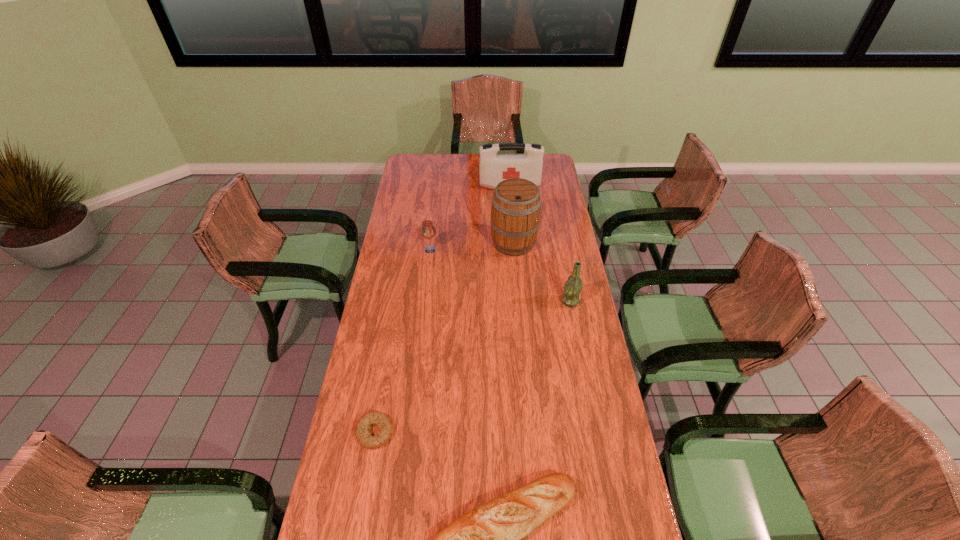
Where is `vacant space located on the surface of the rightmost object`? This screenshot has height=540, width=960. vacant space located on the surface of the rightmost object is located at coordinates (519, 301).

At what (x,y) coordinates should I click in order to perform the action: click on free space located on the surface of the rightmost object. Please return your answer as a coordinate pair (x, y). The width and height of the screenshot is (960, 540). Looking at the image, I should click on (482, 301).

You are a GUI agent. You are given a task and a screenshot of the screen. Output one action in this format:
    pyautogui.click(x=<x>, y=<y>)
    Task: Click on the free spot located 0.200m on the surface of the rightmost object
    
    Given the screenshot: What is the action you would take?
    pyautogui.click(x=512, y=301)

The height and width of the screenshot is (540, 960). In order to click on vacant area situated 0.120m on the right of the fifth object from right to left in this screenshot , I will do `click(464, 249)`.

Where is `free space located on the back of the second nearest object`? The height and width of the screenshot is (540, 960). free space located on the back of the second nearest object is located at coordinates (388, 355).

Locate an element on the screen. object at the left edge is located at coordinates (362, 430).

Where is `the first-aid kit that is at the right edge`? The width and height of the screenshot is (960, 540). the first-aid kit that is at the right edge is located at coordinates (493, 168).

Locate an element on the screen. beer bottle that is at the right edge is located at coordinates (573, 286).

Locate an element on the screen. vacant region at the far edge is located at coordinates (458, 154).

In the image, there is a desktop. At what (x,y) coordinates should I click in order to perform the action: click on free space at the left edge. Please return your answer as a coordinate pair (x, y). The width and height of the screenshot is (960, 540). Looking at the image, I should click on (415, 248).